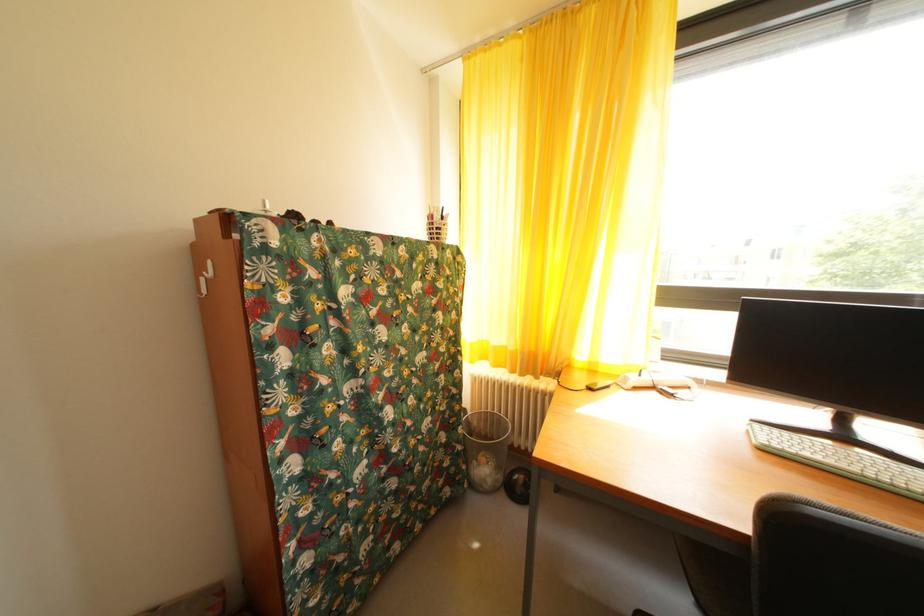
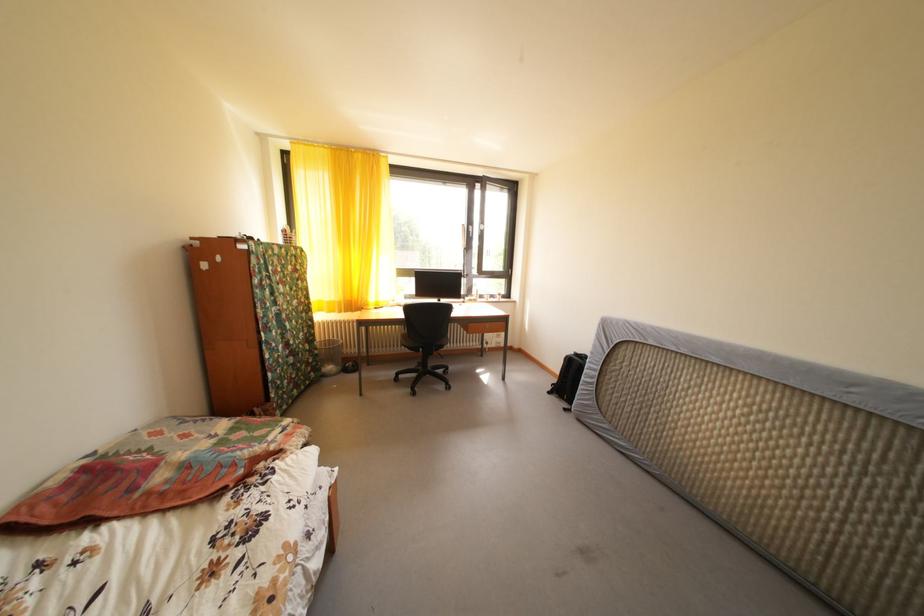
Question: I am providing you with two images of the same scene from different viewpoints. After the viewpoint changes to image2, which objects are now occluded?

Choices:
 (A) white power strip
 (B) tripod adjustment knob
 (C) black backpack
 (D) mesh trash can

Answer: (A)